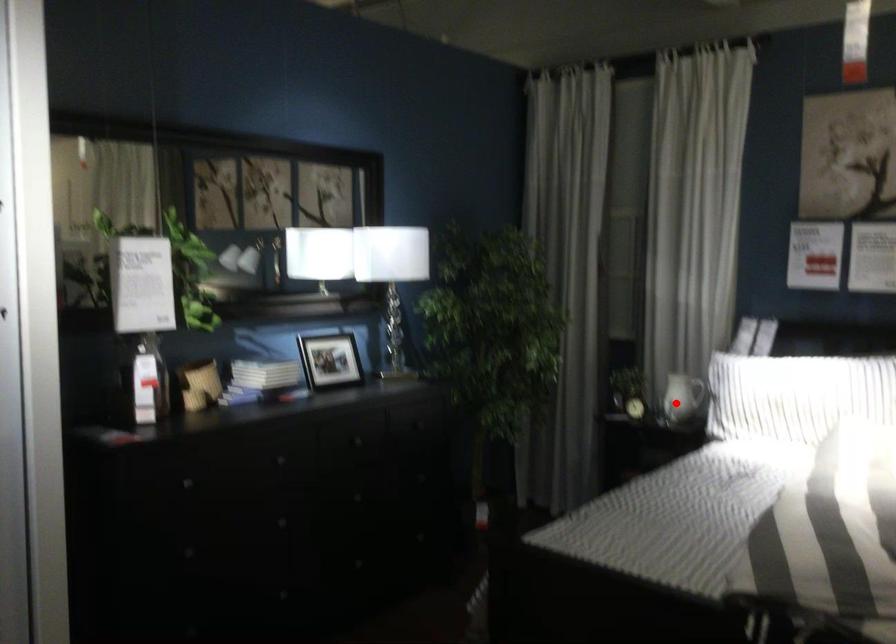
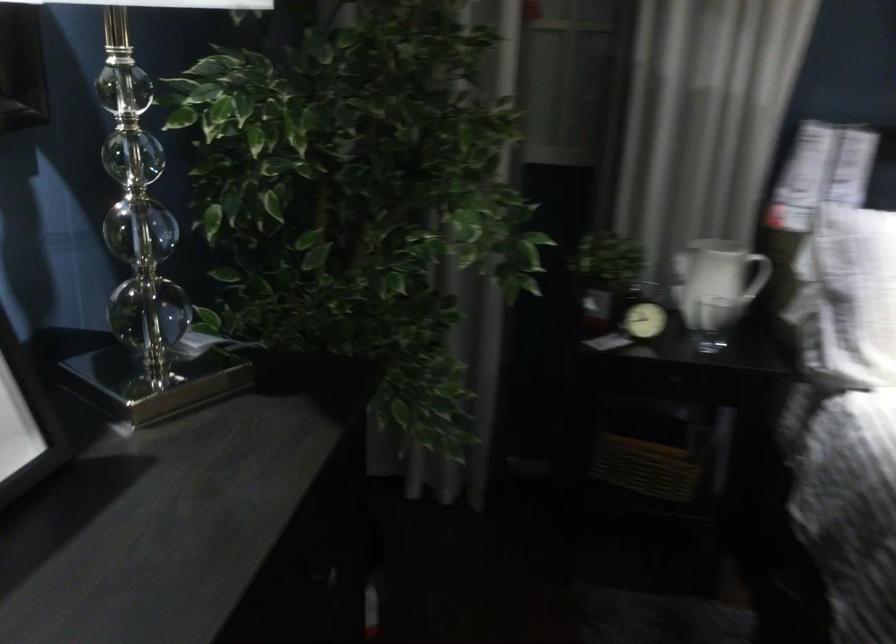
Question: I am providing you with two images of the same scene from different viewpoints. A red point is shown in image1. For the corresponding object point in image2, is it positioned nearer or farther from the camera?

Choices:
 (A) Nearer
 (B) Farther

Answer: (A)